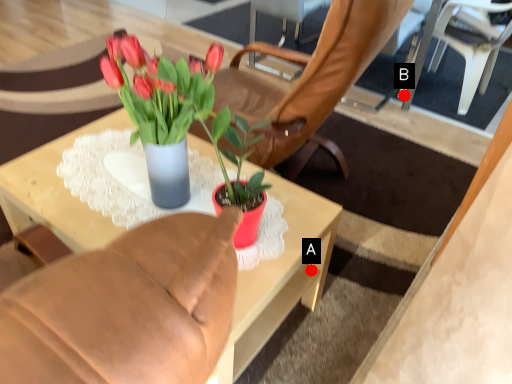
Question: Two points are circled on the image, labeled by A and B beside each circle. Which of the following is the farthest from the observer?

Choices:
 (A) A is further
 (B) B is further

Answer: (B)